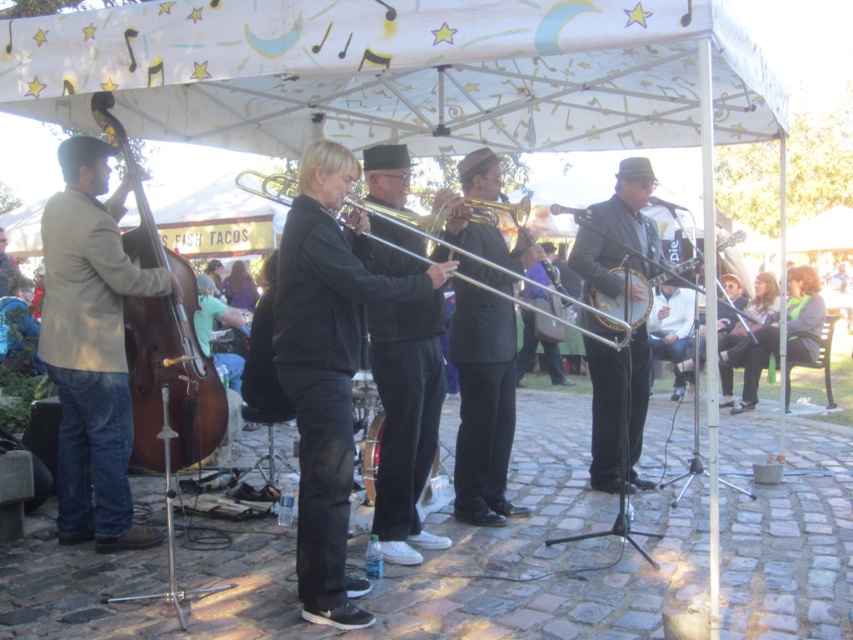
Is black matte trombone at center below brown polished wood double bass at left?

Indeed, black matte trombone at center is positioned under brown polished wood double bass at left.

Can you confirm if black matte trombone at center is positioned to the left of brown polished wood double bass at left?

No, black matte trombone at center is not to the left of brown polished wood double bass at left.

At what (x,y) coordinates should I click in order to perform the action: click on black matte trombone at center. Please return your answer as a coordinate pair (x, y). This screenshot has height=640, width=853. Looking at the image, I should click on (405, 419).

Consider the image. Does black matte trombone at center appear on the right side of silver metallic trombone at center?

No, black matte trombone at center is not to the right of silver metallic trombone at center.

Which is more to the left, black matte trombone at center or silver metallic trombone at center?

Positioned to the left is black matte trombone at center.

This screenshot has height=640, width=853. Find the location of `black matte trombone at center`. black matte trombone at center is located at coordinates (405, 419).

Is shiny silver banjo at center shorter than shiny brass trombone at center?

In fact, shiny silver banjo at center may be taller than shiny brass trombone at center.

Which is below, shiny silver banjo at center or shiny brass trombone at center?

shiny brass trombone at center is below.

Does point (590, 388) come closer to viewer compared to point (430, 500)?

No, it is not.

The width and height of the screenshot is (853, 640). Find the location of `shiny silver banjo at center`. shiny silver banjo at center is located at coordinates (618, 230).